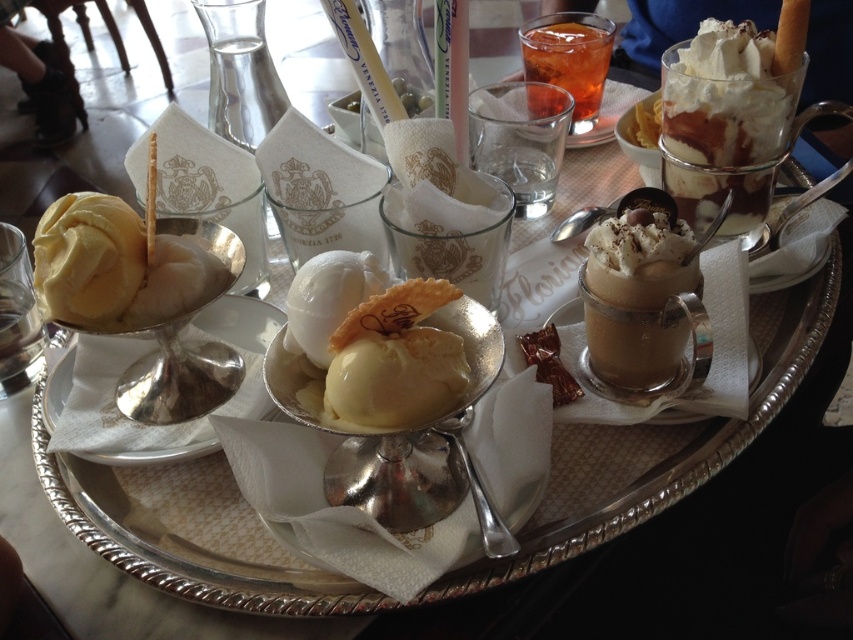
You are a guest at a party and want to reach for the smooth chocolate mousse at center and the translucent glass drink at upper center. Which dessert will you grab first if you want to take the one closer to you?

The smooth chocolate mousse at center is closer to the viewer than the translucent glass drink at upper center, so you should grab the smooth chocolate mousse at center first.

You are a guest at a party and want to choose a dessert from the tray. You notice the yellow creamy ice cream at center and the translucent glass drink at upper center. Which dessert is located to the left of the other?

The yellow creamy ice cream at center is positioned on the left side of translucent glass drink at upper center.

You are at a dessert buffet and want to choose between the yellow creamy ice cream at center and the translucent glass drink at upper center. Which one is shorter?

The yellow creamy ice cream at center is shorter than the translucent glass drink at upper center.